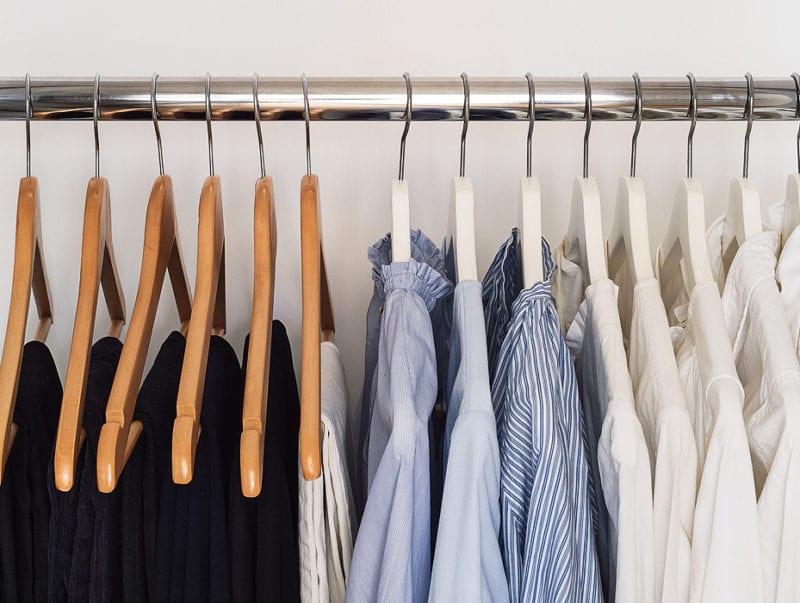
Where is `black clothing hanging on hanger`? This screenshot has width=800, height=603. black clothing hanging on hanger is located at coordinates (38, 380), (96, 371), (154, 377), (225, 380), (277, 386).